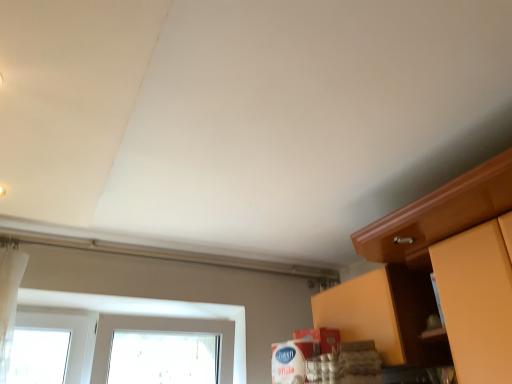
Question: Is matte wood cabinet at right, the 2th cabinetry viewed from the back, aimed at matte wood cabinet at lower right, the first cabinetry from the back?

Choices:
 (A) no
 (B) yes

Answer: (A)

Question: Does matte wood cabinet at right, which is counted as the 1th cabinetry, starting from the front, have a lesser width compared to matte wood cabinet at lower right, positioned as the second cabinetry in front-to-back order?

Choices:
 (A) yes
 (B) no

Answer: (B)

Question: Considering the relative positions of matte wood cabinet at right, which is counted as the 1th cabinetry, starting from the front, and matte wood cabinet at lower right, the first cabinetry from the back, in the image provided, is matte wood cabinet at right, which is counted as the 1th cabinetry, starting from the front, to the left of matte wood cabinet at lower right, the first cabinetry from the back, from the viewer's perspective?

Choices:
 (A) yes
 (B) no

Answer: (B)

Question: Can you confirm if matte wood cabinet at right, the 2th cabinetry viewed from the back, is wider than matte wood cabinet at lower right, the first cabinetry from the back?

Choices:
 (A) yes
 (B) no

Answer: (A)

Question: Does matte wood cabinet at right, the 2th cabinetry viewed from the back, lie behind matte wood cabinet at lower right, positioned as the second cabinetry in front-to-back order?

Choices:
 (A) no
 (B) yes

Answer: (A)

Question: Does matte wood cabinet at right, the 2th cabinetry viewed from the back, have a lesser height compared to matte wood cabinet at lower right, positioned as the second cabinetry in front-to-back order?

Choices:
 (A) no
 (B) yes

Answer: (A)

Question: Is matte wood cabinet at lower right, the first cabinetry from the back, further to the viewer compared to matte wood cabinet at right, the 2th cabinetry viewed from the back?

Choices:
 (A) no
 (B) yes

Answer: (B)

Question: Is matte wood cabinet at lower right, positioned as the second cabinetry in front-to-back order, far away from matte wood cabinet at right, the 2th cabinetry viewed from the back?

Choices:
 (A) no
 (B) yes

Answer: (A)

Question: Is matte wood cabinet at lower right, positioned as the second cabinetry in front-to-back order, facing towards matte wood cabinet at right, the 2th cabinetry viewed from the back?

Choices:
 (A) no
 (B) yes

Answer: (A)

Question: Is matte wood cabinet at right, which is counted as the 1th cabinetry, starting from the front, at the back of matte wood cabinet at lower right, positioned as the second cabinetry in front-to-back order?

Choices:
 (A) yes
 (B) no

Answer: (B)

Question: Considering the relative sizes of matte wood cabinet at lower right, positioned as the second cabinetry in front-to-back order, and matte wood cabinet at right, which is counted as the 1th cabinetry, starting from the front, in the image provided, is matte wood cabinet at lower right, positioned as the second cabinetry in front-to-back order, taller than matte wood cabinet at right, which is counted as the 1th cabinetry, starting from the front,?

Choices:
 (A) no
 (B) yes

Answer: (A)

Question: Is matte wood cabinet at lower right, the first cabinetry from the back, placed right next to matte wood cabinet at right, which is counted as the 1th cabinetry, starting from the front?

Choices:
 (A) no
 (B) yes

Answer: (A)

Question: Does point (378, 286) appear closer or farther from the camera than point (441, 246)?

Choices:
 (A) farther
 (B) closer

Answer: (A)